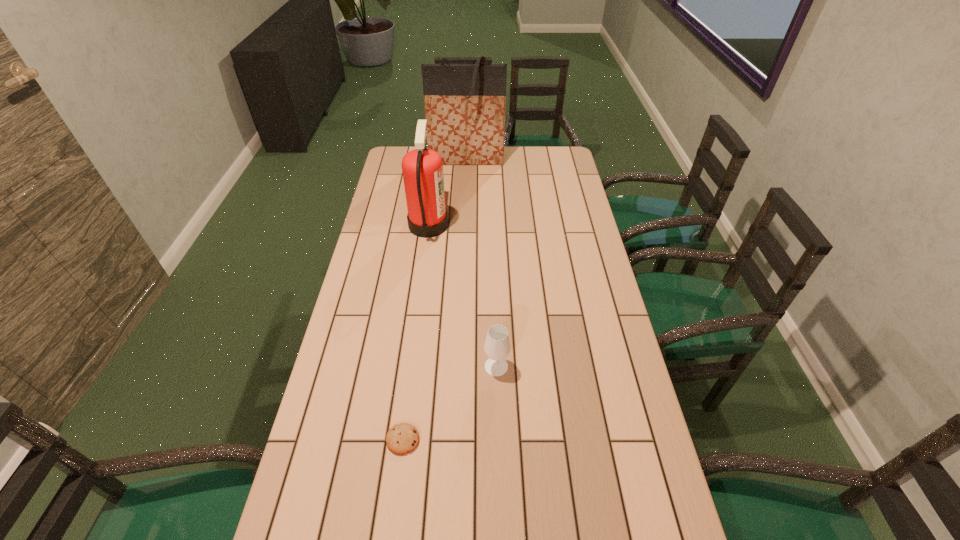
Where is `the farthest object`? This screenshot has width=960, height=540. the farthest object is located at coordinates click(x=465, y=104).

This screenshot has width=960, height=540. In order to click on the tallest object in this screenshot , I will do `click(465, 104)`.

The width and height of the screenshot is (960, 540). Identify the location of the second tallest object. (422, 168).

Find the location of a particular element. Image resolution: width=960 pixels, height=540 pixels. the second farthest object is located at coordinates (422, 168).

Identify the location of the third tallest object. (497, 345).

Locate an element on the screen. This screenshot has height=540, width=960. the third farthest object is located at coordinates (497, 345).

I want to click on the shortest object, so click(402, 438).

Image resolution: width=960 pixels, height=540 pixels. Identify the location of cookie. (402, 438).

Where is `vacant space located on the front-facing side of the shopping bag`? vacant space located on the front-facing side of the shopping bag is located at coordinates (464, 218).

Locate an element on the screen. This screenshot has width=960, height=540. free space located 0.360m at the nozzle of the third nearest object is located at coordinates (540, 225).